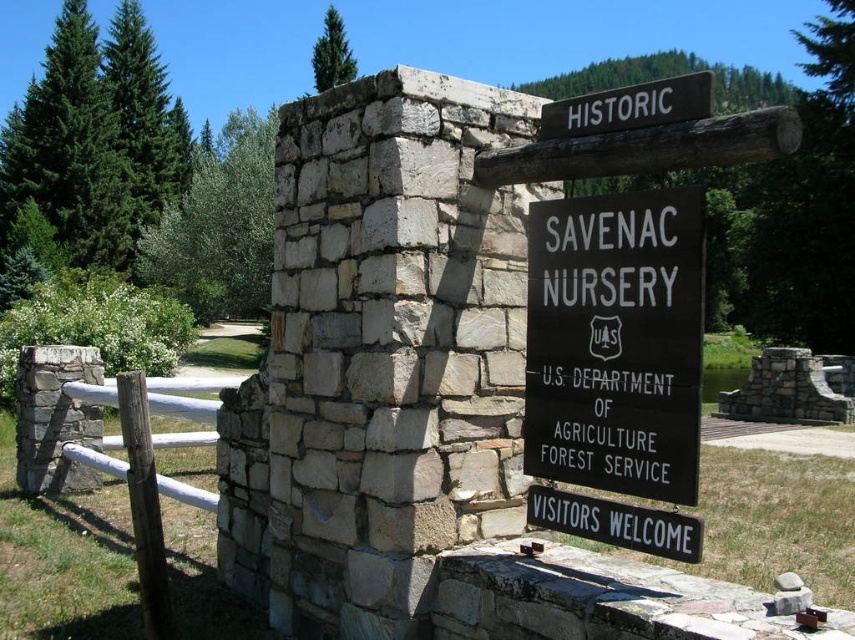
Who is shorter, black wood sign at center or white wood sign at upper center?

white wood sign at upper center

Can you confirm if black wood sign at center is positioned above white wood sign at upper center?

Incorrect, black wood sign at center is not positioned above white wood sign at upper center.

Is point (590, 412) positioned before point (652, 108)?

No, (590, 412) is further to viewer.

You are a GUI agent. You are given a task and a screenshot of the screen. Output one action in this format:
    pyautogui.click(x=<x>, y=<y>)
    Task: Click on the black wood sign at center
    The image size is (855, 640).
    Given the screenshot: What is the action you would take?
    pyautogui.click(x=615, y=342)

Can you confirm if white wooden fence at left is taller than white wood sign at upper center?

No.

Is point (144, 499) farther from camera compared to point (553, 134)?

No, (144, 499) is in front of (553, 134).

Who is more distant from viewer, (95, 397) or (677, 120)?

The point (95, 397) is more distant.

This screenshot has height=640, width=855. Identify the location of white wooden fence at left. (107, 451).

Is black wood sign at center below white wooden fence at left?

No.

Does black wood sign at center appear over white wooden fence at left?

Indeed, black wood sign at center is positioned over white wooden fence at left.

At what (x,y) coordinates should I click in order to perform the action: click on black wood sign at center. Please return your answer as a coordinate pair (x, y). Looking at the image, I should click on (615, 342).